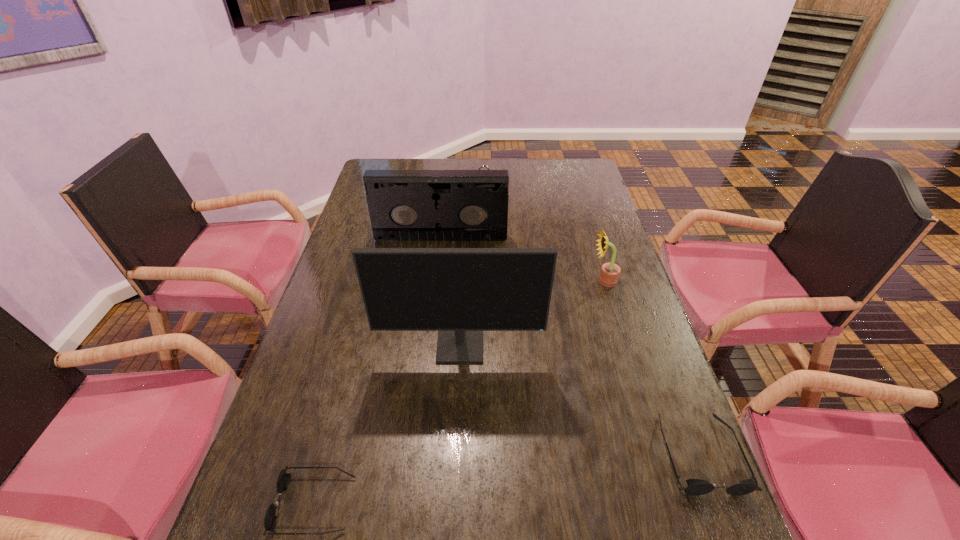
Find the location of a particular element. The image size is (960, 540). computer monitor is located at coordinates (460, 292).

Locate an element on the screen. the third nearest object is located at coordinates (460, 292).

Locate an element on the screen. vacant space located on the front-facing side of the farthest object is located at coordinates (485, 227).

Locate an element on the screen. The height and width of the screenshot is (540, 960). vacant region located on the front side of the second tallest object is located at coordinates (435, 292).

The height and width of the screenshot is (540, 960). What are the coordinates of `vacant space located on the face of the fourth nearest object` in the screenshot? It's located at (540, 281).

The image size is (960, 540). I want to click on vacant space located 0.190m on the face of the fourth nearest object, so click(x=527, y=281).

Find the location of a particular element. The width and height of the screenshot is (960, 540). vacant space located on the face of the fourth nearest object is located at coordinates (554, 281).

What are the coordinates of `vacant space located on the front-facing side of the fourth farthest object` in the screenshot? It's located at (457, 423).

At what (x,y) coordinates should I click in order to perform the action: click on object that is at the far edge. Please return your answer as a coordinate pair (x, y). Looking at the image, I should click on (481, 166).

The height and width of the screenshot is (540, 960). I want to click on sunglasses that is at the left edge, so click(283, 480).